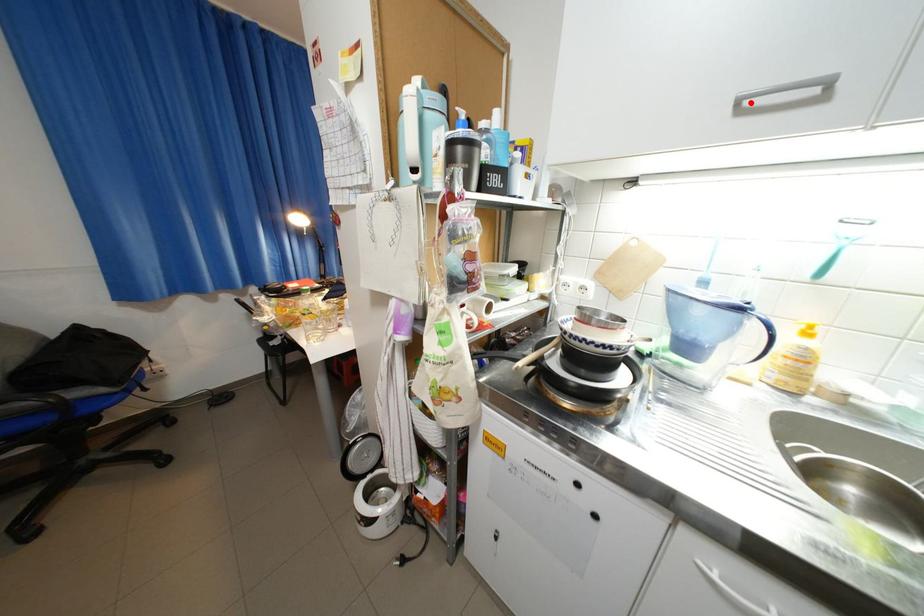
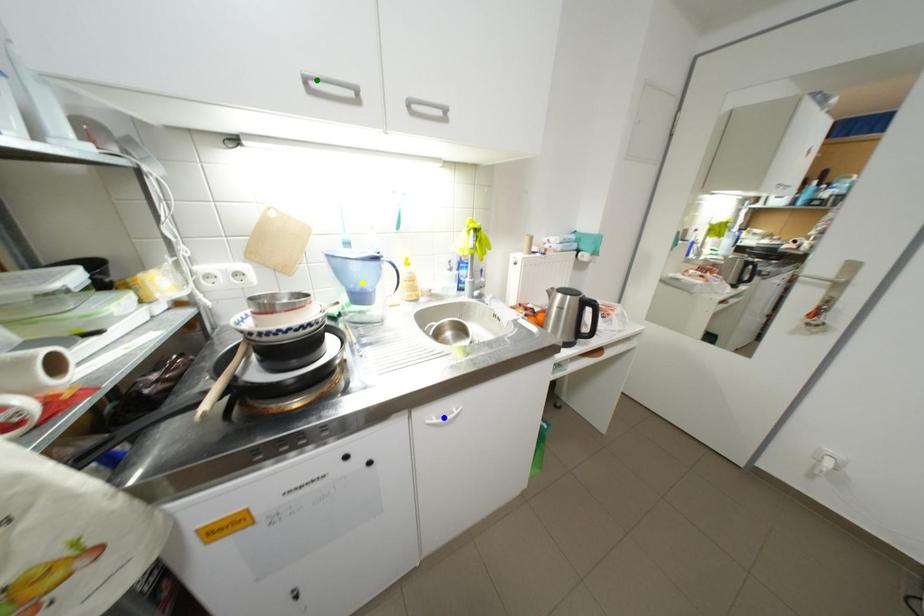
Question: I am providing you with two images of the same scene from different viewpoints. A red point is marked on the first image. You are given multiple points on the second image. In image 2, which mark is for the same physical point as the one in image 1?

Choices:
 (A) yellow point
 (B) green point
 (C) blue point

Answer: (B)